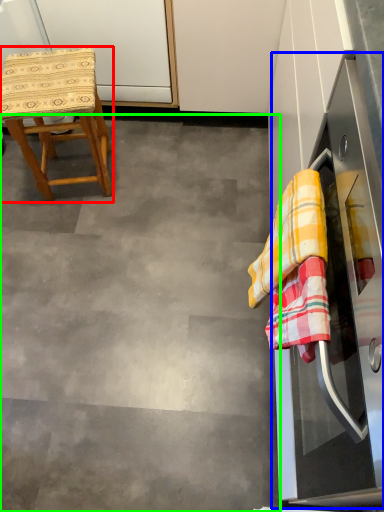
Question: Which object is the farthest from stool (highlighted by a red box)? Choose among these: oven (highlighted by a blue box) or concrete (highlighted by a green box).

Choices:
 (A) oven
 (B) concrete

Answer: (A)